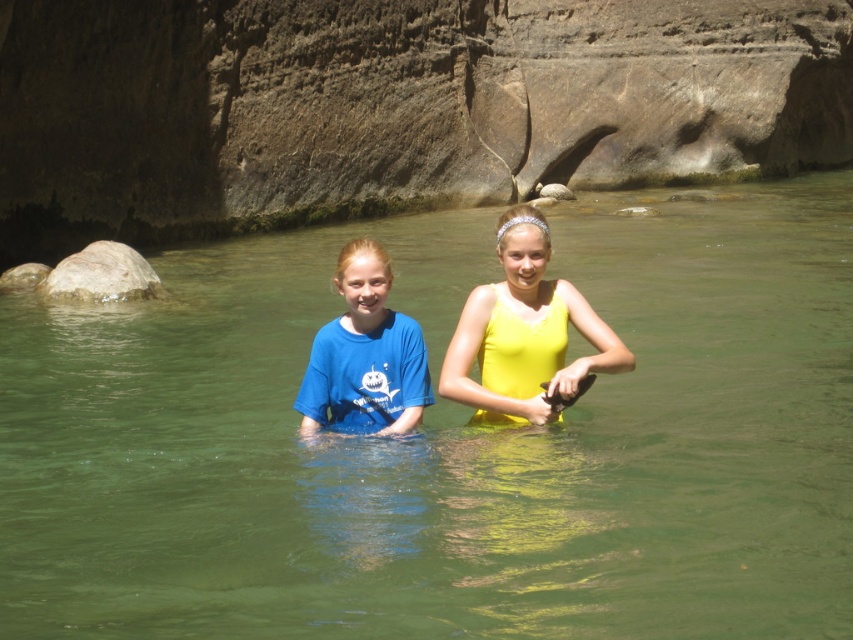
You are standing on the rocky bank of the river and see the green translucent water at center. If you want to cross the river to the other side, which direction should you walk towards?

You should walk towards the green translucent water at center located at point (447, 442) because it is the central area of the river where the water is calm and clear, making it safer to cross.